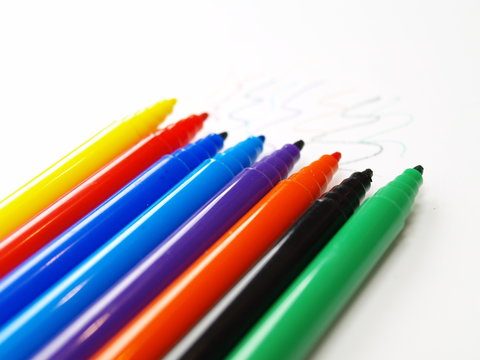
This screenshot has height=360, width=480. What are the coordinates of `felt tip colored markers` in the screenshot? It's located at (52, 190), (60, 202), (81, 228), (102, 246), (140, 270), (171, 289), (293, 316), (257, 294).